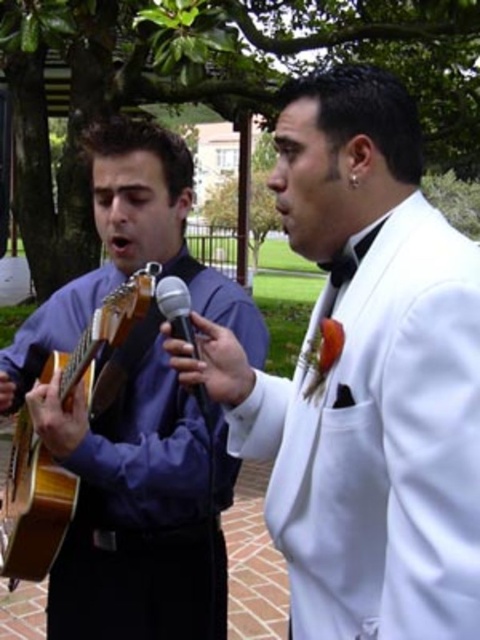
You are at the center of the stage and want to move towards the matte purple shirt at left. Which direction should you move?

You should move to the left since the matte purple shirt at left is located at point (131, 408), which is to the left of the center.

You are a photographer at the event and want to position yourself so that the white satin suit at right is centered in your viewfinder. What coordinate should you aim for?

The white satin suit at right is located at point (364, 378), so you should aim for those coordinates to center it in your viewfinder.

You are a photographer at the event and want to capture a shot where the matte purple shirt at left is visible above the black metallic microphone at center. Is this possible given their current positions?

The matte purple shirt at left is located below the black metallic microphone at center, so it cannot be visible above it in the current arrangement.